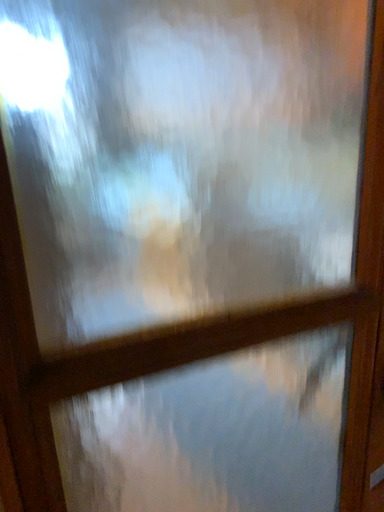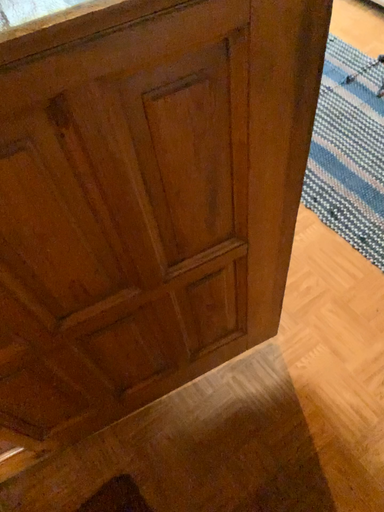
Question: Which way did the camera rotate in the video?

Choices:
 (A) rotated upward
 (B) rotated downward

Answer: (B)